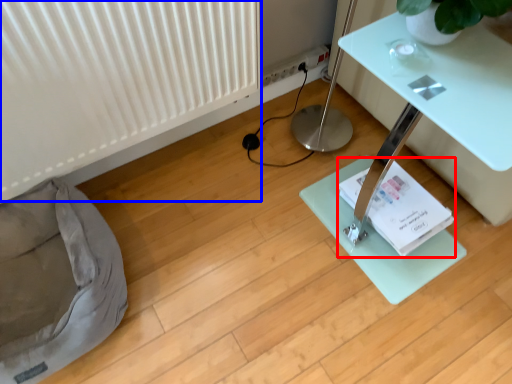
Question: Which of the following is the farthest to the observer, paperback book (highlighted by a red box) or radiator (highlighted by a blue box)?

Choices:
 (A) paperback book
 (B) radiator

Answer: (A)